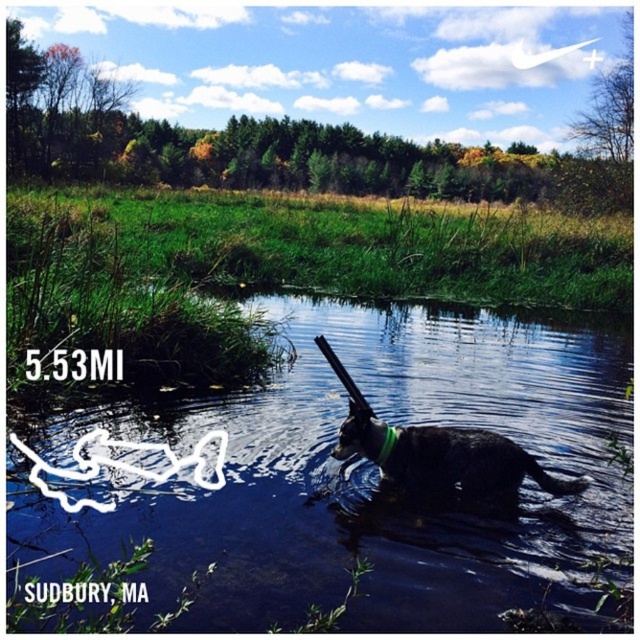
You are a photographer trying to capture the reflection of the dog in the water. Since the black glossy water at lower center and the green fabric neckband at center are both in the frame, which object will show a clearer reflection?

The black glossy water at lower center will show a clearer reflection because it has a larger size compared to the green fabric neckband at center.

In the scene shown: You are standing at the origin point of the coordinate system. The black matte dog at center is located at point 0.727, 0.728. If you want to throw a ball to the dog, in which direction should you aim?

The black matte dog at center is located at point (465, 465), so you should aim towards the upper right direction from your position at the origin.